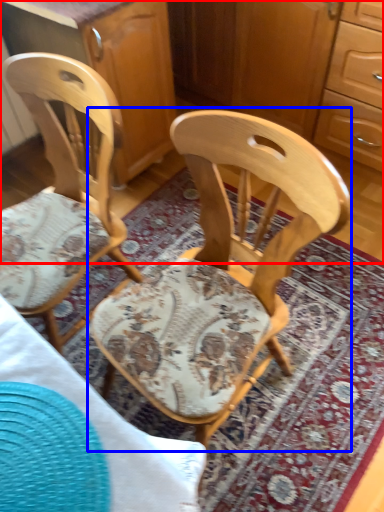
Question: Which object appears closest to the camera in this image, dresser (highlighted by a red box) or chair (highlighted by a blue box)?

Choices:
 (A) dresser
 (B) chair

Answer: (B)